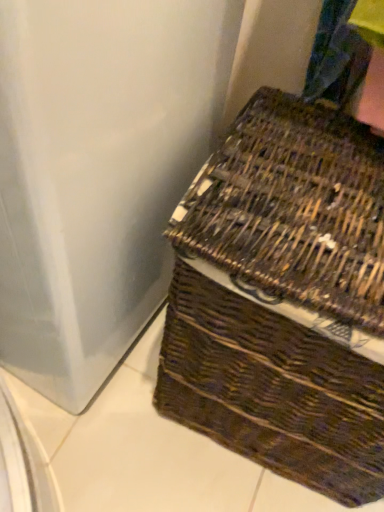
Describe the element at coordinates (283, 298) in the screenshot. This screenshot has height=512, width=384. I see `brown woven picnic basket at center` at that location.

Identify the location of brown woven picnic basket at center. The image size is (384, 512). (283, 298).

Image resolution: width=384 pixels, height=512 pixels. I want to click on brown woven picnic basket at center, so point(283,298).